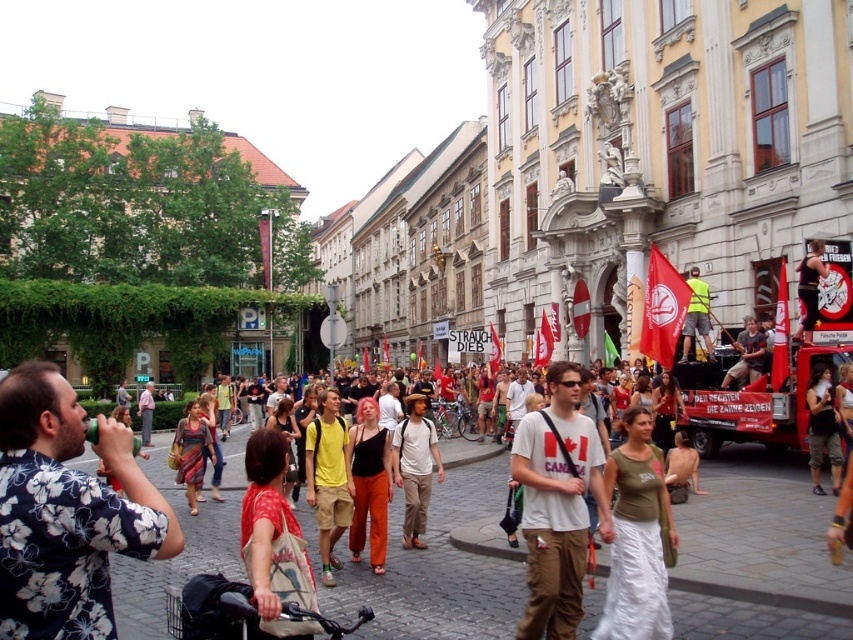
What are the coordinates of `printed fabric bag at center` in the screenshot? It's located at [x=264, y=515].

Is printed fabric bag at center to the left of yellow cotton shirt at center from the viewer's perspective?

Indeed, printed fabric bag at center is positioned on the left side of yellow cotton shirt at center.

Where is `printed fabric bag at center`? printed fabric bag at center is located at coordinates (264, 515).

Does printed fabric bag at center appear on the left side of camouflage shorts at lower right?

Indeed, printed fabric bag at center is positioned on the left side of camouflage shorts at lower right.

Which of these two, printed fabric bag at center or camouflage shorts at lower right, stands shorter?

Standing shorter between the two is camouflage shorts at lower right.

Is point (247, 548) farther from camera compared to point (837, 422)?

No, it is in front of (837, 422).

The height and width of the screenshot is (640, 853). I want to click on printed fabric bag at center, so click(264, 515).

Which of these two, yellow cotton shirt at center or multicolored woven dress at center, stands shorter?

With less height is multicolored woven dress at center.

Locate an element on the screen. yellow cotton shirt at center is located at coordinates (328, 480).

You are a GUI agent. You are given a task and a screenshot of the screen. Output one action in this format:
    pyautogui.click(x=<x>, y=<y>)
    Task: Click on the yellow cotton shirt at center
    
    Given the screenshot: What is the action you would take?
    pyautogui.click(x=328, y=480)